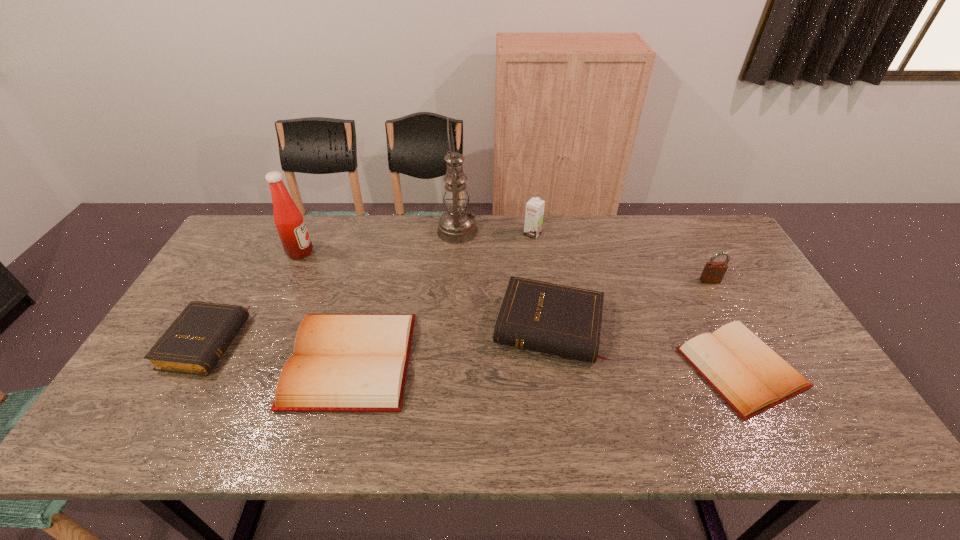
The width and height of the screenshot is (960, 540). Identify the location of the leftmost Bible. (194, 343).

Find the location of a particular element. The width and height of the screenshot is (960, 540). the smaller gray Bible is located at coordinates (194, 343).

Image resolution: width=960 pixels, height=540 pixels. I want to click on the sixth object from right to left, so click(x=341, y=362).

This screenshot has width=960, height=540. What are the coordinates of `the second Bible from left to right` in the screenshot? It's located at [341, 362].

You are a GUI agent. You are given a task and a screenshot of the screen. Output one action in this format:
    pyautogui.click(x=<x>, y=<y>)
    Task: Click on the rightmost Bible
    
    Given the screenshot: What is the action you would take?
    pyautogui.click(x=751, y=377)

Locate an element on the screen. The image size is (960, 540). the smaller red Bible is located at coordinates pyautogui.click(x=751, y=377).

This screenshot has width=960, height=540. I want to click on free region located on the left of the tallest object, so click(408, 231).

This screenshot has width=960, height=540. Identify the location of vacant space located 0.070m on the front-facing side of the condiment. (334, 252).

This screenshot has width=960, height=540. In order to click on free region located 0.320m on the right of the chocolate milk in this screenshot , I will do `click(635, 234)`.

In order to click on free region located 0.390m on the front-facing side of the fifth shortest object in this screenshot , I will do `click(774, 396)`.